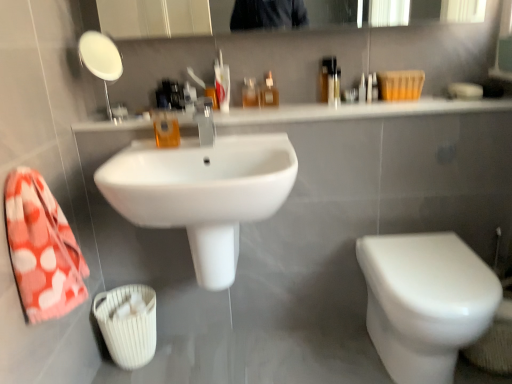
Question: From a real-world perspective, is white glossy sink at upper center positioned under translucent plastic bottle at upper center, which ranks as the 2th mouthwash in back-to-front order, based on gravity?

Choices:
 (A) no
 (B) yes

Answer: (B)

Question: Is white glossy sink at upper center not near translucent plastic bottle at upper center, which ranks as the 2th mouthwash in back-to-front order?

Choices:
 (A) no
 (B) yes

Answer: (A)

Question: Is white glossy sink at upper center looking in the opposite direction of translucent plastic bottle at upper center, which ranks as the 2th mouthwash in back-to-front order?

Choices:
 (A) yes
 (B) no

Answer: (B)

Question: Is white glossy sink at upper center further to camera compared to translucent plastic bottle at upper center, which ranks as the 2th mouthwash in back-to-front order?

Choices:
 (A) no
 (B) yes

Answer: (A)

Question: Is white glossy sink at upper center surrounding translucent plastic bottle at upper center, which ranks as the 2th mouthwash in back-to-front order?

Choices:
 (A) yes
 (B) no

Answer: (B)

Question: From a real-world perspective, is translucent plastic bottle at upper center, the 1th mouthwash when ordered from right to left, above or below white glossy sink at center?

Choices:
 (A) above
 (B) below

Answer: (A)

Question: Considering the relative positions of translucent plastic bottle at upper center, which ranks as the 2th mouthwash in back-to-front order, and white glossy sink at center in the image provided, is translucent plastic bottle at upper center, which ranks as the 2th mouthwash in back-to-front order, to the left or to the right of white glossy sink at center?

Choices:
 (A) left
 (B) right

Answer: (B)

Question: Does point (267, 86) appear closer or farther from the camera than point (176, 155)?

Choices:
 (A) farther
 (B) closer

Answer: (A)

Question: Considering the positions of translucent plastic bottle at upper center, which is the 2th mouthwash in front-to-back order, and white glossy sink at center in the image, is translucent plastic bottle at upper center, which is the 2th mouthwash in front-to-back order, bigger or smaller than white glossy sink at center?

Choices:
 (A) small
 (B) big

Answer: (A)

Question: Is point (103, 79) positioned closer to the camera than point (202, 125)?

Choices:
 (A) farther
 (B) closer

Answer: (A)

Question: From their relative heights in the image, would you say white glossy mirror at upper left is taller or shorter than satin nickel faucet at center?

Choices:
 (A) tall
 (B) short

Answer: (A)

Question: Would you say white glossy mirror at upper left is inside or outside satin nickel faucet at center?

Choices:
 (A) outside
 (B) inside

Answer: (A)

Question: From a real-world perspective, is white glossy mirror at upper left positioned above or below satin nickel faucet at center?

Choices:
 (A) above
 (B) below

Answer: (A)

Question: Looking at the image, does white glossy toilet at lower right seem bigger or smaller compared to white glossy sink at upper center?

Choices:
 (A) small
 (B) big

Answer: (B)

Question: Which is correct: white glossy toilet at lower right is inside white glossy sink at upper center, or outside of it?

Choices:
 (A) outside
 (B) inside

Answer: (A)